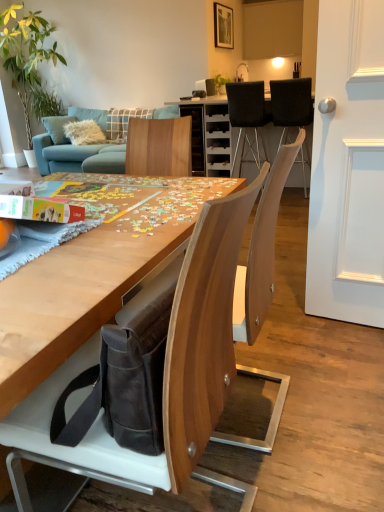
Question: Is matte white cabinet at upper center outside black fabric chair at upper center, which appears as the second chair when ordered from the bottom?

Choices:
 (A) yes
 (B) no

Answer: (A)

Question: Does matte white cabinet at upper center touch black fabric chair at upper center, which appears as the second chair when ordered from the bottom?

Choices:
 (A) yes
 (B) no

Answer: (B)

Question: Is matte white cabinet at upper center oriented away from black fabric chair at upper center, the second chair from the left?

Choices:
 (A) no
 (B) yes

Answer: (A)

Question: Is matte white cabinet at upper center closer to the viewer compared to black fabric chair at upper center, the second chair from the left?

Choices:
 (A) yes
 (B) no

Answer: (B)

Question: Is matte white cabinet at upper center far away from black fabric chair at upper center, which is counted as the 2th chair, starting from the top?

Choices:
 (A) yes
 (B) no

Answer: (A)

Question: From the image's perspective, is matte white cabinet at upper center located beneath black fabric chair at upper center, which is counted as the 2th chair, starting from the top?

Choices:
 (A) no
 (B) yes

Answer: (A)

Question: Is black fabric chair at upper right, the second chair when ordered from front to back, oriented away from matte white cabinet at upper center?

Choices:
 (A) no
 (B) yes

Answer: (A)

Question: Is black fabric chair at upper right, the second chair when ordered from front to back, further to camera compared to matte white cabinet at upper center?

Choices:
 (A) no
 (B) yes

Answer: (A)

Question: Can you confirm if black fabric chair at upper right, the 2th chair in the back-to-front sequence, is positioned to the left of matte white cabinet at upper center?

Choices:
 (A) no
 (B) yes

Answer: (B)

Question: Would you consider black fabric chair at upper right, the second chair when ordered from front to back, to be distant from matte white cabinet at upper center?

Choices:
 (A) no
 (B) yes

Answer: (B)

Question: Is black fabric chair at upper right, the second chair when ordered from front to back, taller than matte white cabinet at upper center?

Choices:
 (A) no
 (B) yes

Answer: (A)

Question: From a real-world perspective, is black fabric chair at upper right, the 2th chair in the back-to-front sequence, on matte white cabinet at upper center?

Choices:
 (A) no
 (B) yes

Answer: (A)

Question: From the image's perspective, is teal fabric couch at upper left beneath wooden chair at center, acting as the first chair starting from the left?

Choices:
 (A) yes
 (B) no

Answer: (B)